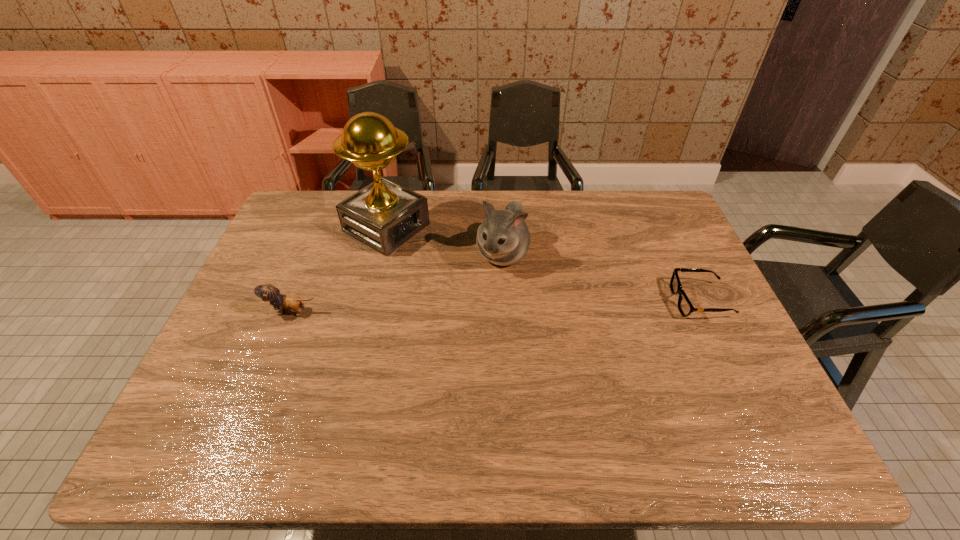
The width and height of the screenshot is (960, 540). What are the coordinates of `vacant space on the desktop that is between the kitten and the sunglasses and is positioned on the face of the hamster` in the screenshot? It's located at (473, 307).

Identify the location of vacant space on the desktop that is between the third tallest object and the sunglasses and is positioned on the front-facing side of the tallest object. (535, 305).